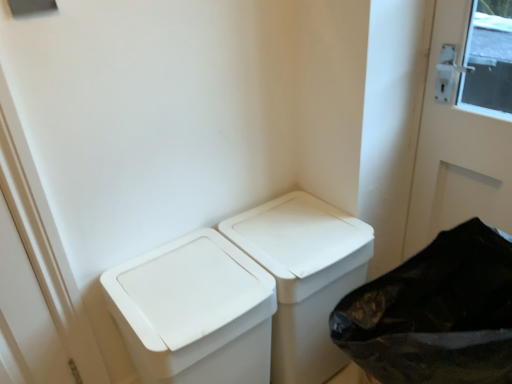
The image size is (512, 384). Describe the element at coordinates (195, 311) in the screenshot. I see `white plastic waste container at center, the first waste container positioned from the left` at that location.

The image size is (512, 384). What do you see at coordinates (435, 313) in the screenshot?
I see `white plastic recycling bin at lower right` at bounding box center [435, 313].

Locate an element on the screen. white plastic waste container at center, the first waste container positioned from the left is located at coordinates (195, 311).

In terms of width, does white plastic waste container at center, the first waste container positioned from the left, look wider or thinner when compared to white plastic recycling bin at lower right?

white plastic waste container at center, the first waste container positioned from the left, is wider than white plastic recycling bin at lower right.

Considering the points (170, 290) and (356, 301), which point is behind, point (170, 290) or point (356, 301)?

Positioned behind is point (170, 290).

From the image's perspective, is white plastic waste container at center, the first waste container positioned from the left, beneath white plastic recycling bin at lower right?

Yes, from the image's perspective, white plastic waste container at center, the first waste container positioned from the left, is below white plastic recycling bin at lower right.

From a real-world perspective, between white plastic waste container at center, the first waste container positioned from the left, and white plastic recycling bin at lower right, who is vertically lower?

white plastic waste container at center, the first waste container positioned from the left.

Considering the relative positions of white plastic recycling bin at lower right and white plastic waste container at center, the first waste container positioned from the left, in the image provided, is white plastic recycling bin at lower right to the left of white plastic waste container at center, the first waste container positioned from the left, from the viewer's perspective?

Incorrect, white plastic recycling bin at lower right is not on the left side of white plastic waste container at center, the first waste container positioned from the left.

From a real-world perspective, between white plastic recycling bin at lower right and white plastic waste container at center, the first waste container positioned from the left, who is vertically lower?

From a 3D spatial view, white plastic waste container at center, the first waste container positioned from the left, is below.

Where is `recycling bin above the white plastic waste container at center, the first waste container positioned from the left (from a real-world perspective)`? This screenshot has height=384, width=512. recycling bin above the white plastic waste container at center, the first waste container positioned from the left (from a real-world perspective) is located at coordinates (435, 313).

Can you confirm if white plastic waste container at center, which ranks as the first waste container in right-to-left order, is thinner than white plastic waste container at center, the first waste container positioned from the left?

Correct, the width of white plastic waste container at center, which ranks as the first waste container in right-to-left order, is less than that of white plastic waste container at center, the first waste container positioned from the left.

Identify the location of waste container located above the white plastic waste container at center, the first waste container positioned from the left (from the image's perspective). (304, 276).

Is white plastic waste container at center, which is the 2th waste container from left to right, next to white plastic waste container at center, the second waste container viewed from the right?

There is a gap between white plastic waste container at center, which is the 2th waste container from left to right, and white plastic waste container at center, the second waste container viewed from the right.

From the image's perspective, who appears lower, white plastic waste container at center, which ranks as the first waste container in right-to-left order, or white plastic waste container at center, the second waste container viewed from the right?

white plastic waste container at center, the second waste container viewed from the right.

From the picture: Do you think white plastic recycling bin at lower right is within white plastic waste container at center, which is the 2th waste container from left to right, or outside of it?

white plastic recycling bin at lower right lies outside white plastic waste container at center, which is the 2th waste container from left to right.

Can you confirm if white plastic recycling bin at lower right is bigger than white plastic waste container at center, which is the 2th waste container from left to right?

Indeed, white plastic recycling bin at lower right has a larger size compared to white plastic waste container at center, which is the 2th waste container from left to right.

How different are the orientations of white plastic recycling bin at lower right and white plastic waste container at center, which is the 2th waste container from left to right, in degrees?

90.9 degrees.

From the image's perspective, would you say white plastic waste container at center, the second waste container viewed from the right, is positioned over white plastic waste container at center, which ranks as the first waste container in right-to-left order?

No, from the image's perspective, white plastic waste container at center, the second waste container viewed from the right, is not over white plastic waste container at center, which ranks as the first waste container in right-to-left order.

Considering the positions of points (190, 296) and (301, 247), is point (190, 296) farther from camera compared to point (301, 247)?

No, (190, 296) is closer to viewer.

Between white plastic waste container at center, the second waste container viewed from the right, and white plastic waste container at center, which ranks as the first waste container in right-to-left order, which one is positioned behind?

white plastic waste container at center, which ranks as the first waste container in right-to-left order.

From a real-world perspective, is white plastic waste container at center, the first waste container positioned from the left, on top of white plastic waste container at center, which is the 2th waste container from left to right?

Correct, in the physical world, white plastic waste container at center, the first waste container positioned from the left, is higher than white plastic waste container at center, which is the 2th waste container from left to right.

From the picture: From the image's perspective, which object appears higher, white plastic waste container at center, which is the 2th waste container from left to right, or white plastic recycling bin at lower right?

Result: white plastic waste container at center, which is the 2th waste container from left to right, appears higher in the image.

Considering the positions of objects white plastic waste container at center, which ranks as the first waste container in right-to-left order, and white plastic recycling bin at lower right in the image provided, who is more to the left, white plastic waste container at center, which ranks as the first waste container in right-to-left order, or white plastic recycling bin at lower right?

Positioned to the left is white plastic waste container at center, which ranks as the first waste container in right-to-left order.

Between white plastic waste container at center, which ranks as the first waste container in right-to-left order, and white plastic recycling bin at lower right, which one has smaller width?

white plastic recycling bin at lower right.

You are a GUI agent. You are given a task and a screenshot of the screen. Output one action in this format:
    pyautogui.click(x=<x>, y=<y>)
    Task: Click on the recycling bin that is above the white plastic waste container at center, the first waste container positioned from the left (from the image's perspective)
    
    Given the screenshot: What is the action you would take?
    pyautogui.click(x=435, y=313)

Where is `recycling bin on the right side of white plastic waste container at center, the first waste container positioned from the left`? The height and width of the screenshot is (384, 512). recycling bin on the right side of white plastic waste container at center, the first waste container positioned from the left is located at coordinates (435, 313).

Looking at the image, which one is located further to white plastic waste container at center, which ranks as the first waste container in right-to-left order, white plastic recycling bin at lower right or white plastic waste container at center, the first waste container positioned from the left?

white plastic recycling bin at lower right is further to white plastic waste container at center, which ranks as the first waste container in right-to-left order.

Based on their spatial positions, is white plastic waste container at center, which is the 2th waste container from left to right, or white plastic waste container at center, the first waste container positioned from the left, further from white plastic recycling bin at lower right?

white plastic waste container at center, the first waste container positioned from the left, is positioned further to the anchor white plastic recycling bin at lower right.

When comparing their distances from white plastic waste container at center, which is the 2th waste container from left to right, does white plastic waste container at center, the first waste container positioned from the left, or white plastic recycling bin at lower right seem further?

white plastic recycling bin at lower right.

Looking at the image, which one is located closer to white plastic recycling bin at lower right, white plastic waste container at center, the first waste container positioned from the left, or white plastic waste container at center, which is the 2th waste container from left to right?

white plastic waste container at center, which is the 2th waste container from left to right, is positioned closer to the anchor white plastic recycling bin at lower right.

Based on the photo, when comparing their distances from white plastic waste container at center, the first waste container positioned from the left, does white plastic waste container at center, which is the 2th waste container from left to right, or white plastic recycling bin at lower right seem further?

white plastic recycling bin at lower right is positioned further to the anchor white plastic waste container at center, the first waste container positioned from the left.

Looking at the image, which one is located closer to white plastic waste container at center, the second waste container viewed from the right, white plastic recycling bin at lower right or white plastic waste container at center, which ranks as the first waste container in right-to-left order?

white plastic waste container at center, which ranks as the first waste container in right-to-left order, lies closer to white plastic waste container at center, the second waste container viewed from the right, than the other object.

Locate an element on the screen. This screenshot has width=512, height=384. waste container located between white plastic recycling bin at lower right and white plastic waste container at center, which is the 2th waste container from left to right, in the depth direction is located at coordinates (195, 311).